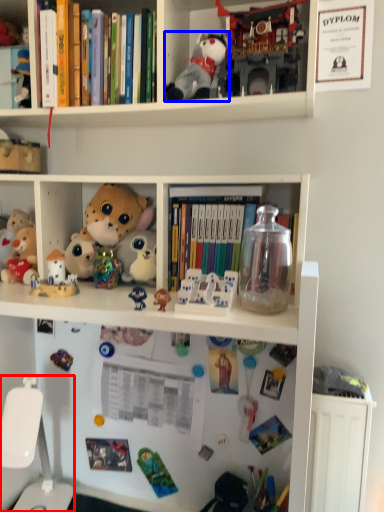
Question: Which point is further to the camera, swivel chair (highlighted by a red box) or toy (highlighted by a blue box)?

Choices:
 (A) swivel chair
 (B) toy

Answer: (B)